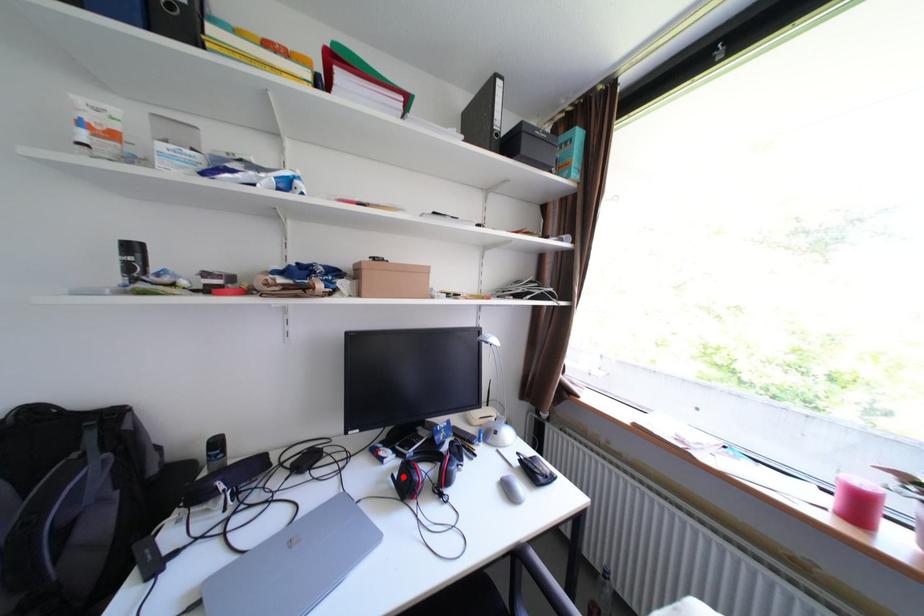
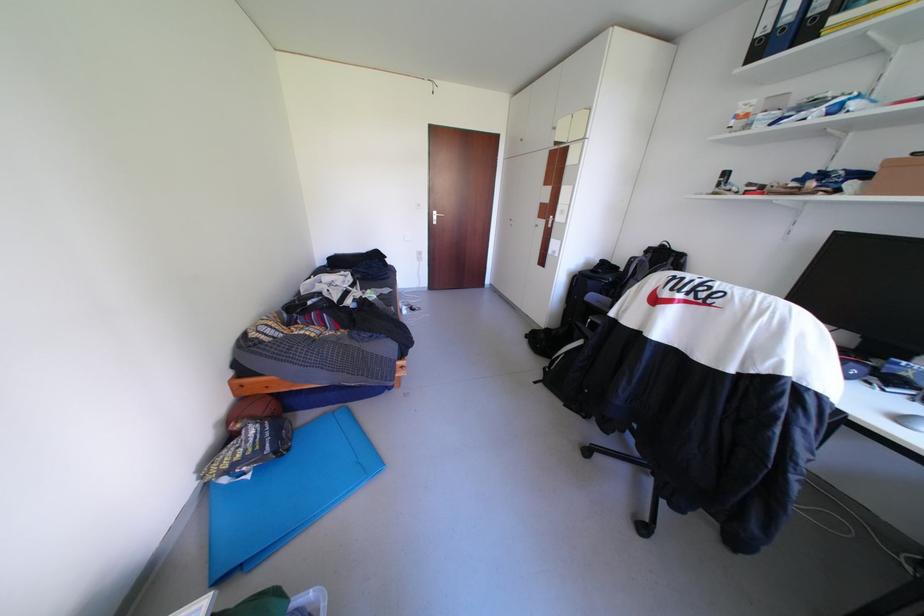
Question: I am providing you with two images of the same scene from different viewpoints. A red point is marked on the first image. Can you still see the location of the red point in image 2?

Choices:
 (A) Yes
 (B) No

Answer: (B)